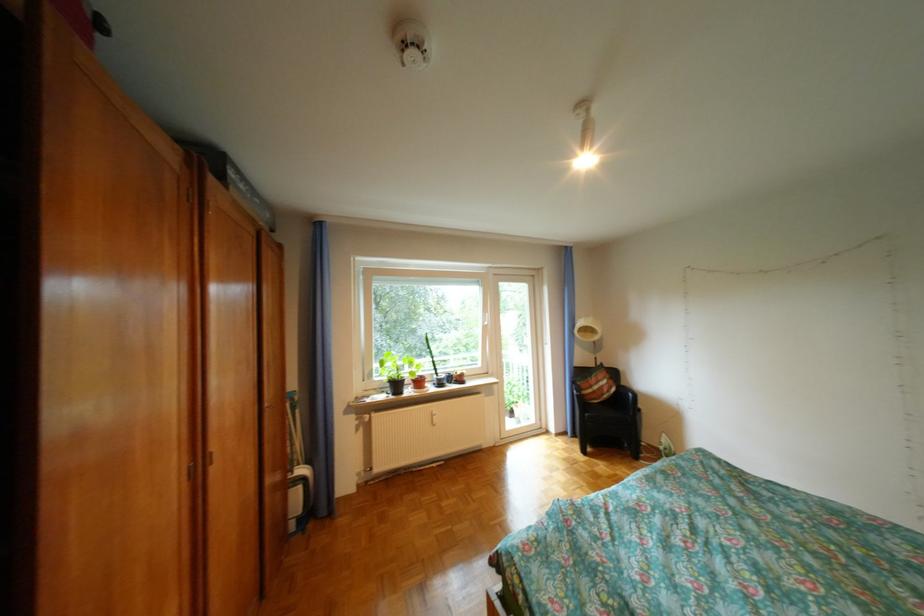
Locate an element on the screen. The width and height of the screenshot is (924, 616). black chair sitting surface is located at coordinates (606, 416).